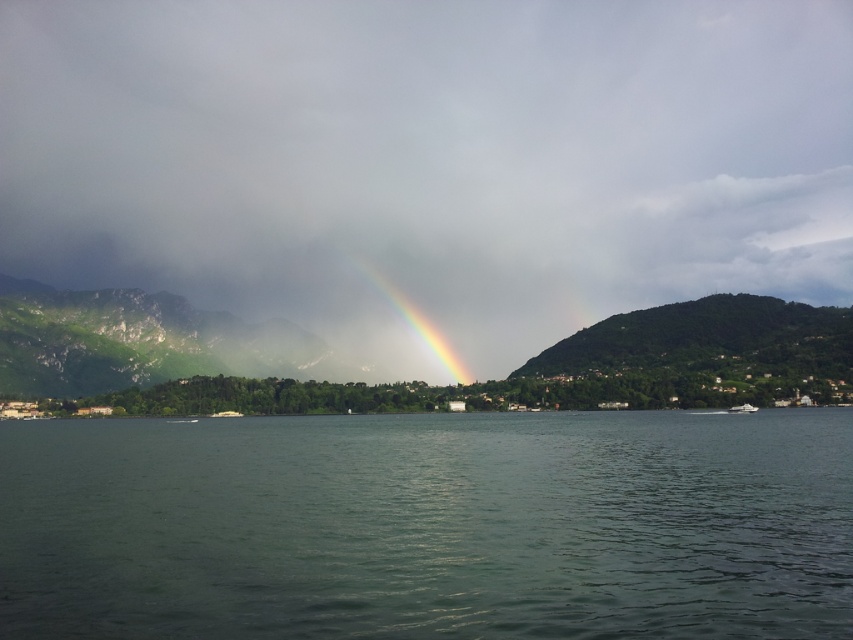
Between green textured mountain at center and white glossy boat at lower right, which one appears on the left side from the viewer's perspective?

green textured mountain at center is more to the left.

The height and width of the screenshot is (640, 853). In order to click on green textured mountain at center in this screenshot , I will do `click(422, 380)`.

The height and width of the screenshot is (640, 853). What are the coordinates of `green textured mountain at center` in the screenshot? It's located at (422, 380).

Looking at this image, does green water at center have a smaller size compared to rainbow at center?

Actually, green water at center might be larger than rainbow at center.

Does green water at center appear over rainbow at center?

Incorrect, green water at center is not positioned above rainbow at center.

In order to click on green water at center in this screenshot , I will do `click(428, 525)`.

The width and height of the screenshot is (853, 640). In order to click on green water at center in this screenshot , I will do click(x=428, y=525).

Who is higher up, green textured mountain at center or rainbow at center?

rainbow at center is higher up.

Is green textured mountain at center below rainbow at center?

Yes.

Identify the location of green textured mountain at center. (422, 380).